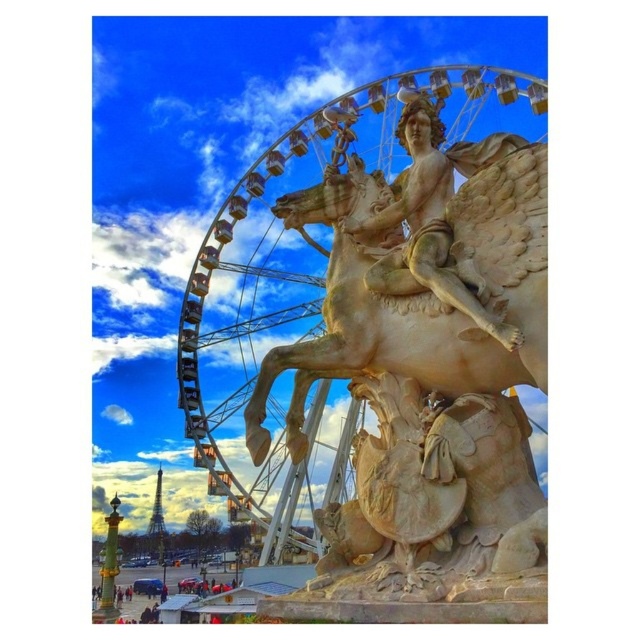
Is metallic ferris wheel at center further to the viewer compared to polished stone statue at center?

Yes, metallic ferris wheel at center is behind polished stone statue at center.

Who is taller, metallic ferris wheel at center or polished stone statue at center?

metallic ferris wheel at center is taller.

The height and width of the screenshot is (640, 640). Find the location of `metallic ferris wheel at center`. metallic ferris wheel at center is located at coordinates (301, 282).

Identify the location of metallic ferris wheel at center. (301, 282).